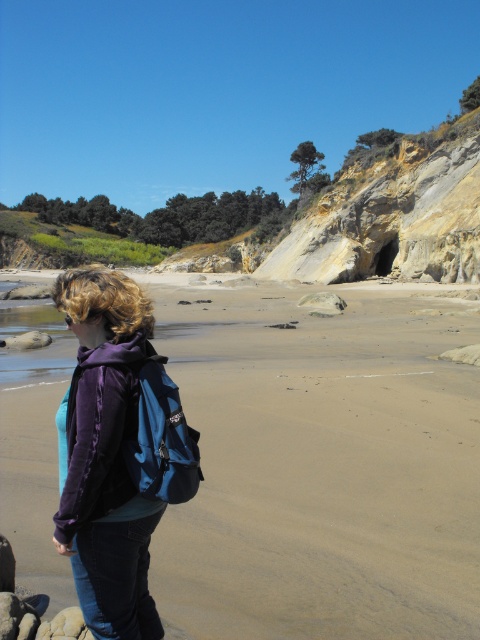
Question: Which is nearer to the brown sandy beach at lower center?

Choices:
 (A) purple fleece jacket at lower left
 (B) smooth gray rock at center

Answer: (B)

Question: Is brown sandy beach at lower center smaller than purple fleece jacket at lower left?

Choices:
 (A) yes
 (B) no

Answer: (B)

Question: Which of the following is the closest to the observer?

Choices:
 (A) (317, 300)
 (B) (262, 609)
 (C) (84, 273)

Answer: (C)

Question: In this image, where is brown sandy beach at lower center located relative to purple fleece jacket at lower left?

Choices:
 (A) below
 (B) above

Answer: (B)

Question: Which point is closer to the camera?

Choices:
 (A) brown sandy beach at lower center
 (B) smooth gray rock at center

Answer: (A)

Question: Is brown sandy beach at lower center below purple fleece jacket at lower left?

Choices:
 (A) yes
 (B) no

Answer: (B)